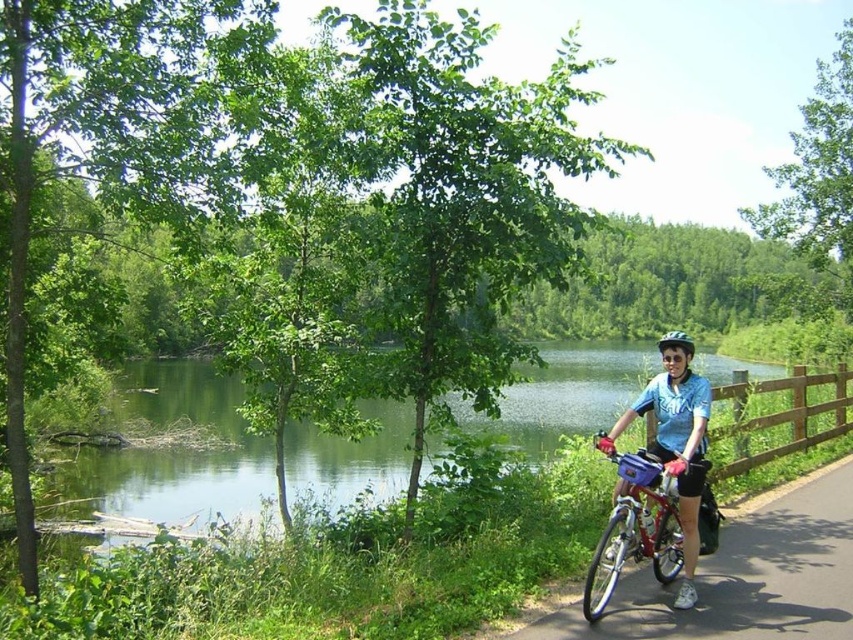
Question: Which point is closer to the camera taking this photo?

Choices:
 (A) (793, 396)
 (B) (677, 342)
 (C) (769, 568)

Answer: (B)

Question: Does blue fabric shirt at center appear under black matte helmet at upper right?

Choices:
 (A) yes
 (B) no

Answer: (A)

Question: Where is metallic silver bicycle at lower right located in relation to black matte helmet at upper right in the image?

Choices:
 (A) right
 (B) left

Answer: (B)

Question: Based on their relative distances, which object is farther from the brown wooden fence at right?

Choices:
 (A) blue fabric shirt at center
 (B) metallic silver bicycle at lower right

Answer: (A)

Question: Does blue fabric shirt at center have a smaller size compared to brown wooden fence at right?

Choices:
 (A) yes
 (B) no

Answer: (B)

Question: Which point appears closest to the camera in this image?

Choices:
 (A) (799, 403)
 (B) (692, 353)
 (C) (657, 564)
 (D) (830, 532)

Answer: (B)